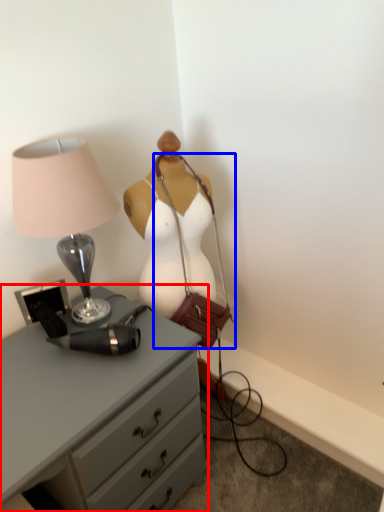
Question: Among these objects, which one is farthest to the camera, chest of drawers (highlighted by a red box) or handbag (highlighted by a blue box)?

Choices:
 (A) chest of drawers
 (B) handbag

Answer: (B)